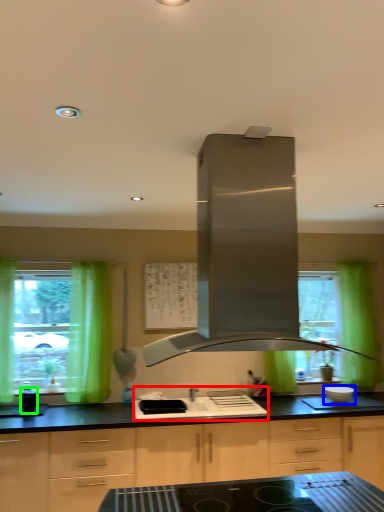
Question: Estimate the real-world distances between objects in this image. Which object is closer to sink (highlighted by a red box), kitchen appliance (highlighted by a blue box) or appliance (highlighted by a green box)?

Choices:
 (A) kitchen appliance
 (B) appliance

Answer: (A)